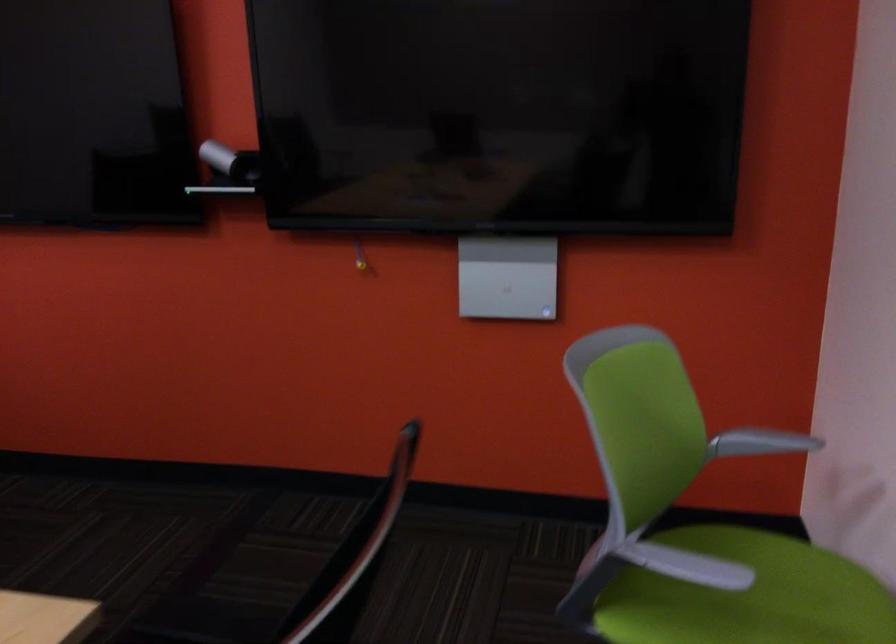
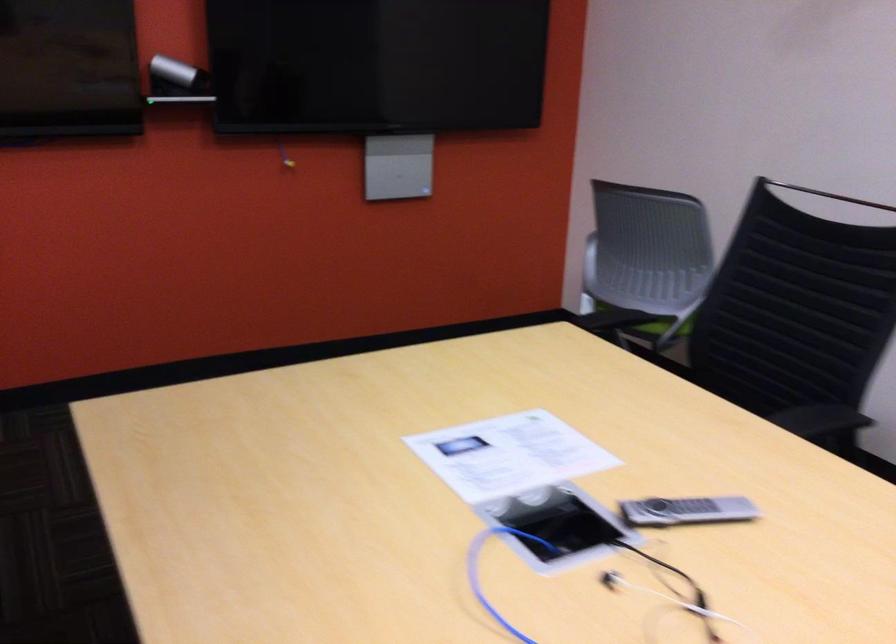
Question: I am providing you with two images of the same scene from different viewpoints. Please identify which objects are invisible in image2.

Choices:
 (A) grey remote control
 (B) black tablet
 (C) pink and grey backpack
 (D) grey chair armrest

Answer: (D)